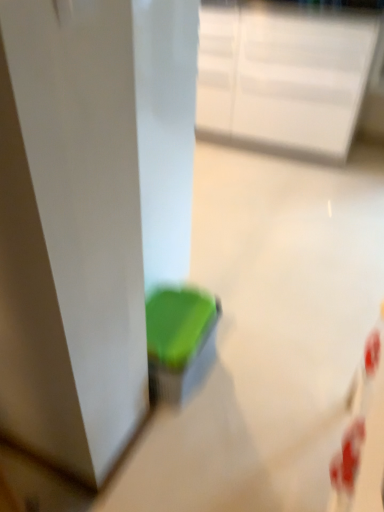
The width and height of the screenshot is (384, 512). I want to click on green plastic container at center, so click(x=179, y=340).

What do you see at coordinates (179, 340) in the screenshot? I see `green plastic container at center` at bounding box center [179, 340].

The height and width of the screenshot is (512, 384). I want to click on green plastic container at center, so click(x=179, y=340).